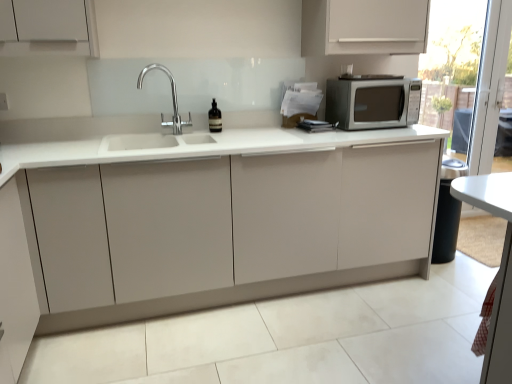
Locate an element on the screen. This screenshot has height=384, width=512. satin silver microwave at upper right is located at coordinates (373, 101).

This screenshot has height=384, width=512. I want to click on white glossy table at lower right, so click(x=499, y=268).

Image resolution: width=512 pixels, height=384 pixels. What do you see at coordinates (453, 68) in the screenshot? I see `transparent glass screen door at right` at bounding box center [453, 68].

The height and width of the screenshot is (384, 512). In order to click on brown glass bottle at center in this screenshot , I will do `click(215, 118)`.

What do you see at coordinates (215, 118) in the screenshot?
I see `brown glass bottle at center` at bounding box center [215, 118].

You are a GUI agent. You are given a task and a screenshot of the screen. Output one action in this format:
    pyautogui.click(x=<x>, y=<y>)
    Task: Click on the satin silver microwave at upper right
    The image size is (512, 384).
    Given the screenshot: What is the action you would take?
    pyautogui.click(x=373, y=101)

Is chrome/metallic faucet at center located outside satin silver microwave at upper right?

chrome/metallic faucet at center lies outside satin silver microwave at upper right's area.

The image size is (512, 384). In the image, there is a chrome/metallic faucet at center. Identify the location of microwave oven below it (from a real-world perspective). (373, 101).

Considering the sizes of objects white glossy table at lower right and transparent glass screen door at right in the image provided, who is thinner, white glossy table at lower right or transparent glass screen door at right?

transparent glass screen door at right is thinner.

Where is `table directly beneath the transparent glass screen door at right (from a real-world perspective)`? Image resolution: width=512 pixels, height=384 pixels. table directly beneath the transparent glass screen door at right (from a real-world perspective) is located at coordinates (499, 268).

Is white glossy table at lower right positioned behind transparent glass screen door at right?

No, white glossy table at lower right is closer to the viewer.

Does white glossy table at lower right have a larger size compared to transparent glass screen door at right?

Actually, white glossy table at lower right might be smaller than transparent glass screen door at right.

Between chrome/metallic faucet at center and matte white cabinet at center, which one has smaller size?

Smaller between the two is chrome/metallic faucet at center.

Considering the relative sizes of chrome/metallic faucet at center and matte white cabinet at center in the image provided, is chrome/metallic faucet at center taller than matte white cabinet at center?

Incorrect, the height of chrome/metallic faucet at center is not larger of that of matte white cabinet at center.

Does chrome/metallic faucet at center lie behind matte white cabinet at center?

Yes.

Measure the distance between chrome/metallic faucet at center and matte white cabinet at center.

chrome/metallic faucet at center and matte white cabinet at center are 33.16 inches apart from each other.

Could you tell me if white glossy table at lower right is turned towards chrome/metallic faucet at center?

No, white glossy table at lower right is not oriented towards chrome/metallic faucet at center.

Considering the sizes of objects white glossy table at lower right and chrome/metallic faucet at center in the image provided, who is wider, white glossy table at lower right or chrome/metallic faucet at center?

chrome/metallic faucet at center is wider.

Is white glossy table at lower right positioned far away from chrome/metallic faucet at center?

Absolutely, white glossy table at lower right is distant from chrome/metallic faucet at center.

Is point (402, 88) farther from viewer compared to point (458, 216)?

No.

Is satin silver microwave at upper right wider than transparent glass screen door at right?

Yes, satin silver microwave at upper right is wider than transparent glass screen door at right.

Is satin silver microwave at upper right smaller than transparent glass screen door at right?

Correct, satin silver microwave at upper right occupies less space than transparent glass screen door at right.

Identify the location of screen door on the right of satin silver microwave at upper right. Image resolution: width=512 pixels, height=384 pixels. (453, 68).

Which is more to the left, satin silver microwave at upper right or white glossy table at lower right?

satin silver microwave at upper right is more to the left.

Is satin silver microwave at upper right facing away from white glossy table at lower right?

No, white glossy table at lower right is not at the back of satin silver microwave at upper right.

Considering the positions of points (353, 99) and (509, 259), is point (353, 99) closer to camera compared to point (509, 259)?

No.

Relative to chrome/metallic faucet at center, is brown glass bottle at center in front or behind?

In the image, brown glass bottle at center appears behind chrome/metallic faucet at center.

Is brown glass bottle at center oriented towards chrome/metallic faucet at center?

No.

Is point (216, 119) closer or farther from the camera than point (177, 105)?

Point (216, 119) is closer to the camera than point (177, 105).

Is brown glass bottle at center far away from chrome/metallic faucet at center?

No, brown glass bottle at center is not far away from chrome/metallic faucet at center.

I want to click on tap above the satin silver microwave at upper right (from a real-world perspective), so click(x=172, y=99).

The height and width of the screenshot is (384, 512). I want to click on screen door behind the white glossy table at lower right, so click(453, 68).

From the image, which object appears to be nearer to satin silver microwave at upper right, brown glass bottle at center or transparent glass screen door at right?

The object closer to satin silver microwave at upper right is brown glass bottle at center.

Which object lies further to the anchor point brown glass bottle at center, transparent glass screen door at right or white glossy table at lower right?

transparent glass screen door at right.

Based on their spatial positions, is chrome/metallic faucet at center or white glossy table at lower right closer to transparent glass screen door at right?

chrome/metallic faucet at center is positioned closer to the anchor transparent glass screen door at right.

From the image, which object appears to be farther from transparent glass screen door at right, satin silver microwave at upper right or chrome/metallic faucet at center?

Based on the image, chrome/metallic faucet at center appears to be further to transparent glass screen door at right.

Considering their positions, is white glossy table at lower right positioned closer to chrome/metallic faucet at center than satin silver microwave at upper right?

Based on the image, satin silver microwave at upper right appears to be nearer to chrome/metallic faucet at center.

Estimate the real-world distances between objects in this image. Which object is further from white glossy table at lower right, chrome/metallic faucet at center or transparent glass screen door at right?

transparent glass screen door at right is positioned further to the anchor white glossy table at lower right.

When comparing their distances from brown glass bottle at center, does transparent glass screen door at right or chrome/metallic faucet at center seem further?

transparent glass screen door at right lies further to brown glass bottle at center than the other object.

Which object lies further to the anchor point brown glass bottle at center, white glossy table at lower right or matte white cabinet at center?

The object further to brown glass bottle at center is white glossy table at lower right.

At what (x,y) coordinates should I click in order to perform the action: click on cabinetry positioned between white glossy table at lower right and satin silver microwave at upper right from near to far. Please return your answer as a coordinate pair (x, y). This screenshot has height=384, width=512. Looking at the image, I should click on (215, 218).

I want to click on microwave oven located between chrome/metallic faucet at center and transparent glass screen door at right in the left-right direction, so click(373, 101).

Locate an element on the screen. wine bottle situated between chrome/metallic faucet at center and white glossy table at lower right from left to right is located at coordinates (215, 118).

You are a GUI agent. You are given a task and a screenshot of the screen. Output one action in this format:
    pyautogui.click(x=<x>, y=<y>)
    Task: Click on the table between matte white cabinet at center and transparent glass screen door at right from left to right
    Image resolution: width=512 pixels, height=384 pixels.
    Given the screenshot: What is the action you would take?
    pyautogui.click(x=499, y=268)